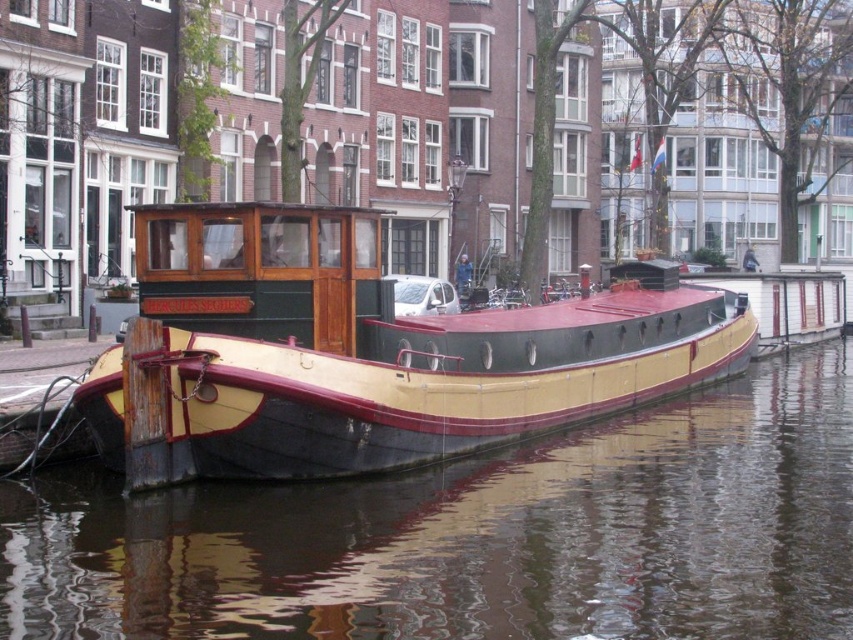
You are a photographer planning to take a photo of the wooden cabin cruiser at center and the smooth water at center. Which object will occupy more space in your photo?

The wooden cabin cruiser at center is larger than the smooth water at center, so it will occupy more space in the photo.

You are standing on the canal bank and see the smooth water at center and the wooden cabin cruiser at center. Which object is closer to you?

The smooth water at center is in front of the wooden cabin cruiser at center, so it is closer to you.

From the picture: You are a photographer planning to take a photo of the smooth water at center and the wooden cabin cruiser at center. Which object appears narrower in the photo?

The smooth water at center appears narrower than the wooden cabin cruiser at center in the photo.